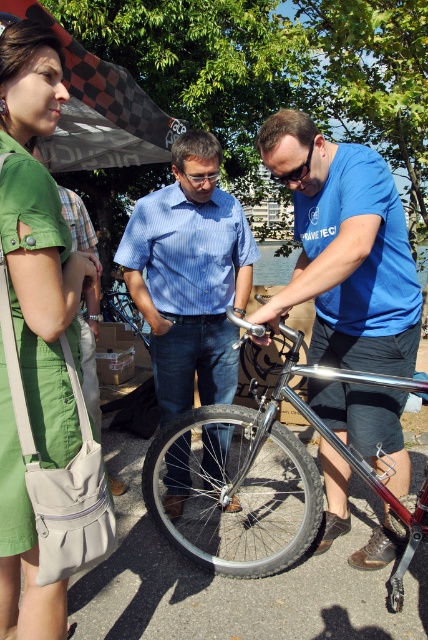
Is point (32, 253) in front of point (193, 412)?

Yes.

Image resolution: width=428 pixels, height=640 pixels. What do you see at coordinates (38, 237) in the screenshot?
I see `green cotton dress at upper left` at bounding box center [38, 237].

Which is behind, point (20, 52) or point (311, 412)?

Point (311, 412)

At what (x,y) coordinates should I click in order to perform the action: click on green cotton dress at upper left. Please return your answer as a coordinate pair (x, y). Looking at the image, I should click on (38, 237).

Is shiny metallic bicycle at center shorter than black rubber tire at center?

Incorrect, shiny metallic bicycle at center's height does not fall short of black rubber tire at center's.

Which is below, shiny metallic bicycle at center or black rubber tire at center?

black rubber tire at center is below.

Identify the location of shiny metallic bicycle at center. (261, 483).

The height and width of the screenshot is (640, 428). I want to click on shiny metallic bicycle at center, so click(261, 483).

Does green cotton dress at upper left have a lesser width compared to black rubber tire at center?

Yes.

The height and width of the screenshot is (640, 428). Find the location of `green cotton dress at upper left`. green cotton dress at upper left is located at coordinates (38, 237).